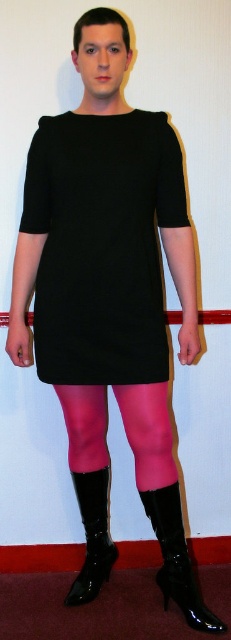
Question: Which point appears farthest from the camera in this image?

Choices:
 (A) (136, 442)
 (B) (182, 577)
 (C) (151, 234)
 (D) (82, 513)

Answer: (D)

Question: Does black matte dress at center have a smaller size compared to glossy patent leather boot at lower center?

Choices:
 (A) no
 (B) yes

Answer: (A)

Question: Which object is positioned farthest from the pink sheer tights at lower center?

Choices:
 (A) black patent leather boot at lower center
 (B) glossy patent leather boot at lower center

Answer: (B)

Question: Which point is closer to the camera?

Choices:
 (A) glossy patent leather boot at lower center
 (B) black matte dress at center

Answer: (B)

Question: Does glossy patent leather boot at lower center have a lesser width compared to black patent leather boot at lower center?

Choices:
 (A) no
 (B) yes

Answer: (A)

Question: Is pink sheer tights at lower center positioned before glossy patent leather boot at lower center?

Choices:
 (A) yes
 (B) no

Answer: (A)